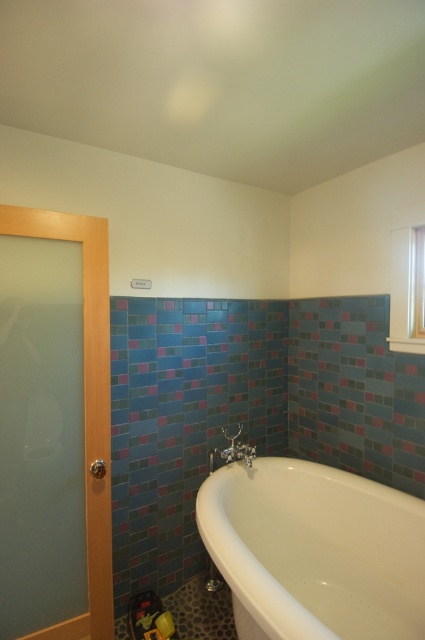
You are standing in the bathroom and want to locate the white glossy bathtub at lower right. According to the coordinates provided, where would you find it?

The white glossy bathtub at lower right is located at point (314, 552).

You are a plumber inspecting the bathroom and need to replace the chrome metallic faucet at lower center. The new faucet requires a space that is 10 cm wider than the current one. Can the white glossy bathtub at lower right accommodate this? Please explain.

The white glossy bathtub at lower right is bigger than the chrome metallic faucet at lower center, but the exact dimensions are not provided. Therefore, it is uncertain if there is enough space for the new faucet requiring 10 cm more width.